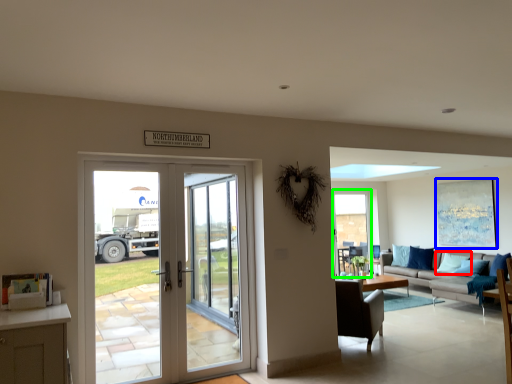
Question: Which object is positioned closest to pillow (highlighted by a red box)? Select from picture frame (highlighted by a blue box) and window screen (highlighted by a green box).

Choices:
 (A) picture frame
 (B) window screen

Answer: (A)